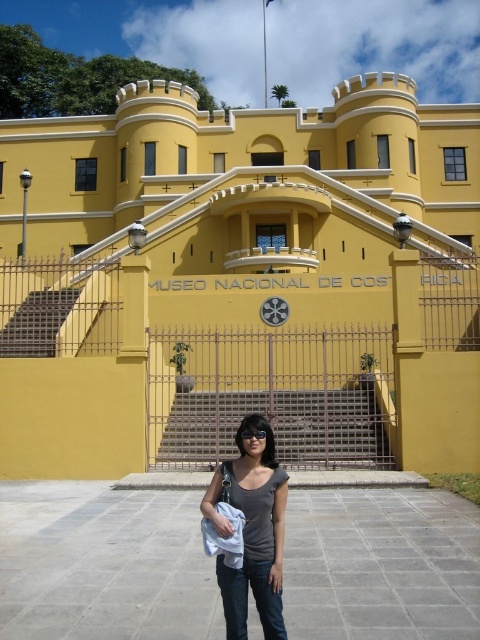
You are standing in front of the Museo Nacional de Costa Rica. You see a yellow matte building at center and a gray matte shirt at center. Which object is positioned to the left?

The yellow matte building at center is to the left of the gray matte shirt at center.

You are standing at the entrance of the Museo Nacional de Costa Rica. You want to take a photo of the yellow matte building at center. Where should you position yourself to capture it in the frame?

To capture the yellow matte building at center in your photo, position yourself at the entrance where you can aim your camera towards the coordinates point (240, 284) where the building is located.

You are standing in front of the Museo Nacional de Costa Rica. You see a yellow matte building at center and a gray matte shirt at center. If you want to reach the building, how many steps would you need to take if each step covers 2.5 feet?

The distance between the yellow matte building at center and the gray matte shirt at center is 130.65 feet. Dividing this distance by the step length of 2.5 feet per step gives approximately 52.26 steps. Since you can only take whole steps, you would need to take 53 steps to reach the building.